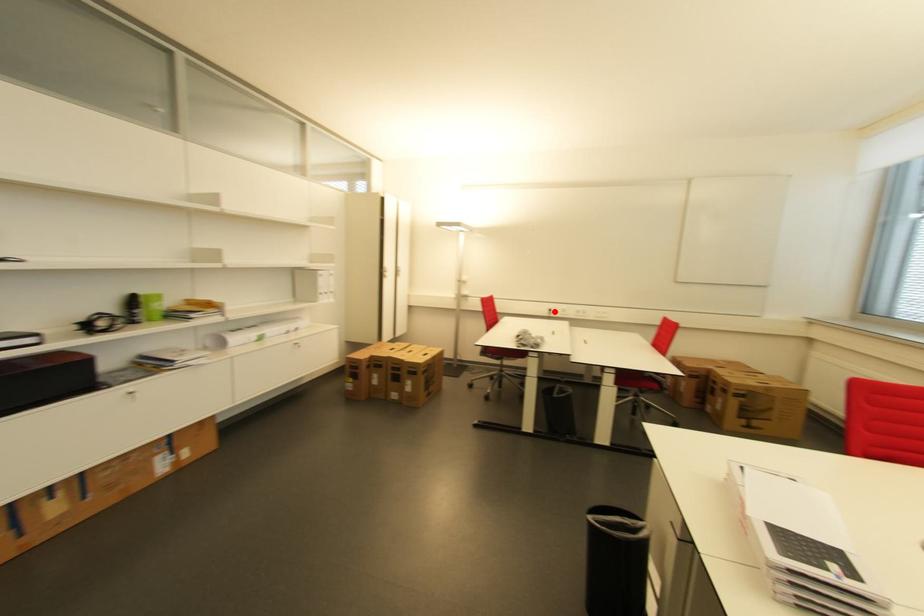
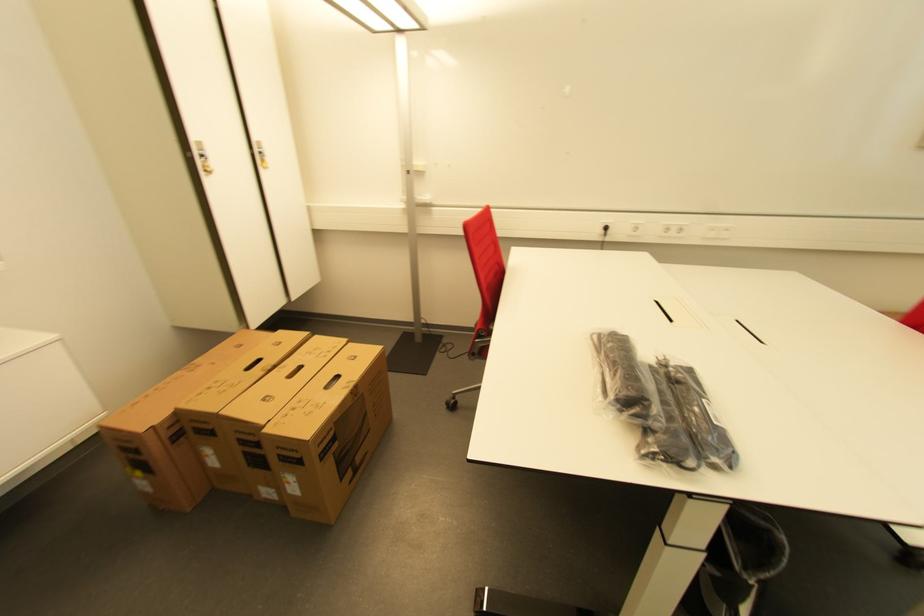
Where in the second image is the point corresponding to the highlighted location from the first image?

(611, 230)